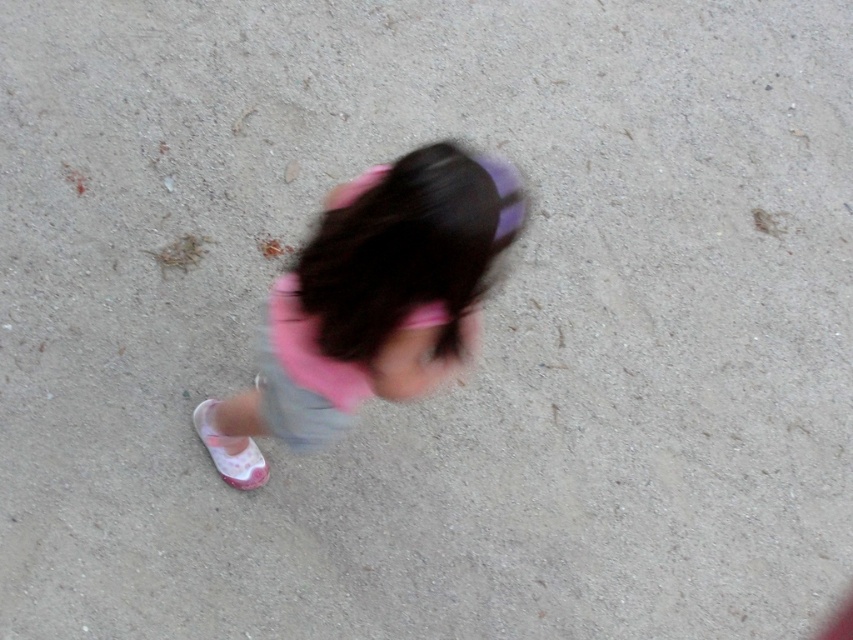
You are a photographer who wants to focus on the pink fabric dress at center. Based on the scene, where should you adjust your camera focus to ensure the dress is in the center of the frame?

The pink fabric dress at center is located at point 0.472 on the x axis and 0.436 on the y axis, so you should adjust your camera focus to those coordinates to center the dress in the frame.

Based on the scene description, which object is bigger between the pink fabric dress at center and the pink fabric shoe at lower left?

The pink fabric dress at center is larger in size than the pink fabric shoe at lower left according to the description.